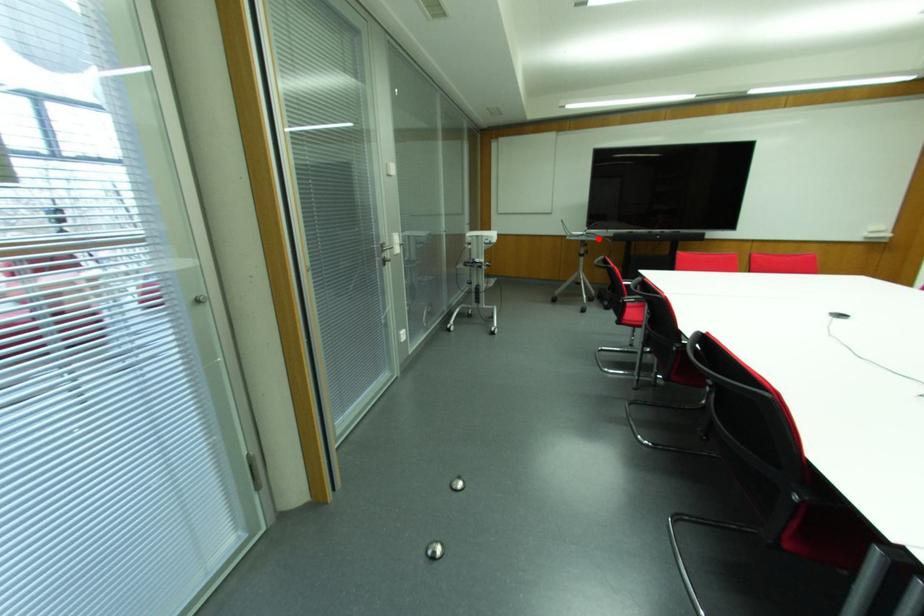
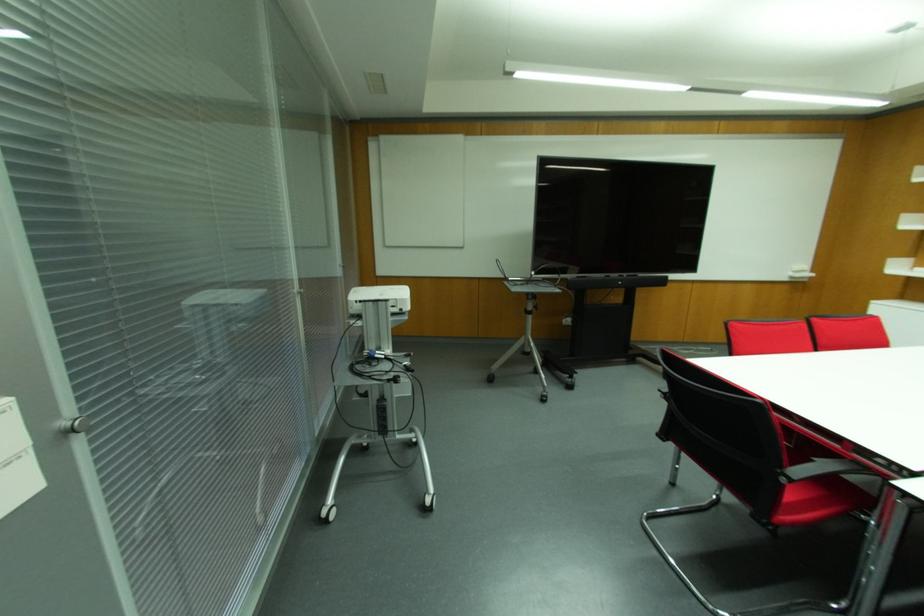
Locate, in the second image, the point that corresponds to the highlighted location in the first image.

(556, 290)